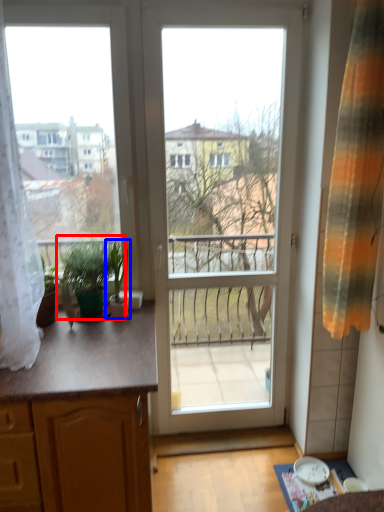
Question: Which point is closer to the camera, houseplant (highlighted by a red box) or houseplant (highlighted by a blue box)?

Choices:
 (A) houseplant
 (B) houseplant

Answer: (A)